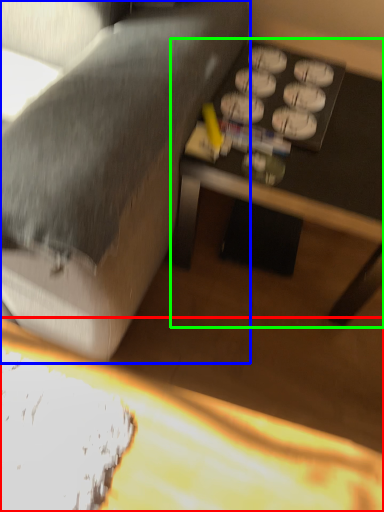
Question: Which object is positioned closest to table (highlighted by a red box)? Select from studio couch (highlighted by a blue box) and table (highlighted by a green box).

Choices:
 (A) studio couch
 (B) table

Answer: (A)